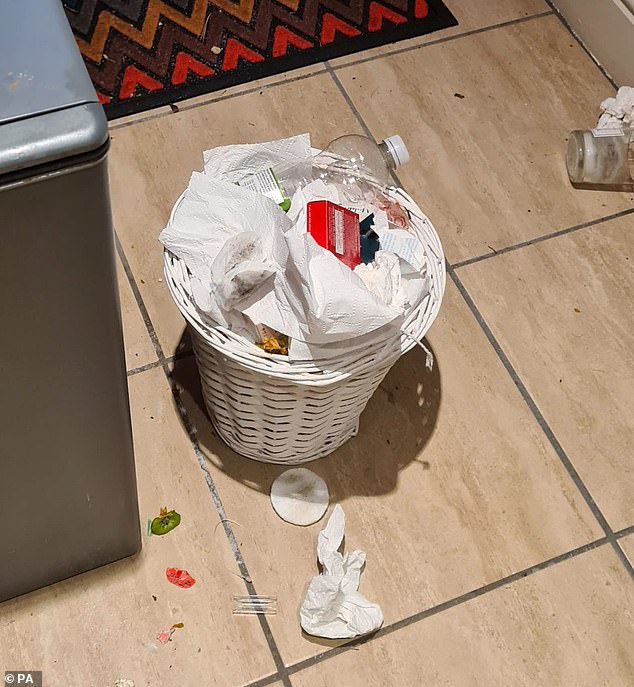
At what (x,y) coordinates should I click in order to perform the action: click on wicker waste baskets. Please return your answer as a coordinate pair (x, y). The image size is (634, 687). Looking at the image, I should click on (285, 424).